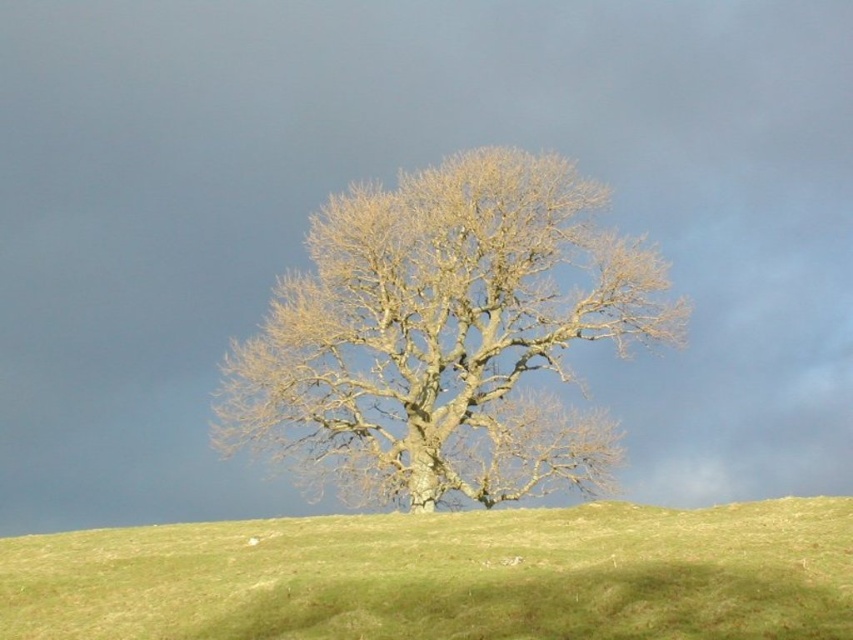
Question: Which point is closer to the camera taking this photo?

Choices:
 (A) (561, 252)
 (B) (415, 634)

Answer: (B)

Question: Which of the following is the closest to the observer?

Choices:
 (A) (595, 276)
 (B) (827, 500)

Answer: (B)

Question: Observing the image, what is the correct spatial positioning of bare wood tree at center in reference to green grassy hillside at center?

Choices:
 (A) left
 (B) right

Answer: (A)

Question: Does bare wood tree at center appear on the left side of green grassy hillside at center?

Choices:
 (A) yes
 (B) no

Answer: (A)

Question: Among these points, which one is farthest from the camera?

Choices:
 (A) (488, 268)
 (B) (193, 616)

Answer: (A)

Question: Does bare wood tree at center have a larger size compared to green grassy hillside at center?

Choices:
 (A) yes
 (B) no

Answer: (B)